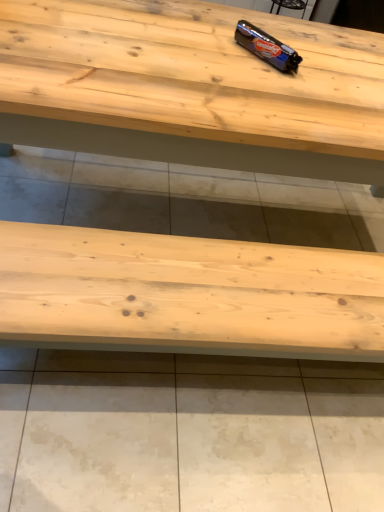
Image resolution: width=384 pixels, height=512 pixels. I want to click on vacant space in front of shiny metallic chocolate bar at upper center, so click(x=260, y=78).